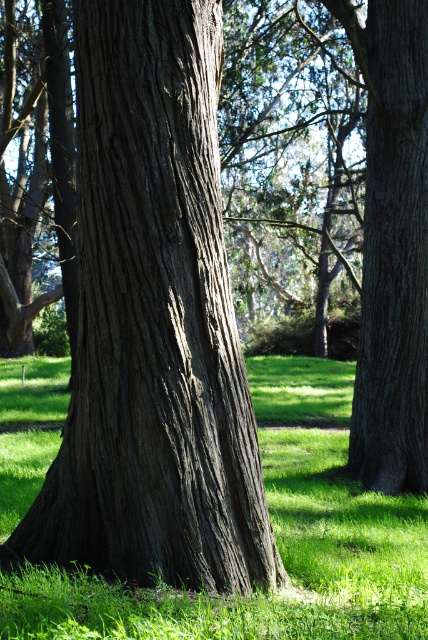
Which is more to the right, dark brown textured bark at center or dark brown textured tree trunk at center?

dark brown textured tree trunk at center is more to the right.

Looking at this image, does dark brown textured bark at center appear under dark brown textured tree trunk at center?

Yes.

This screenshot has height=640, width=428. Describe the element at coordinates (154, 321) in the screenshot. I see `dark brown textured bark at center` at that location.

What are the coordinates of `dark brown textured bark at center` in the screenshot? It's located at (154, 321).

Does dark brown textured bark at center have a greater height compared to green grassy at center?

Correct, dark brown textured bark at center is much taller as green grassy at center.

Can you confirm if dark brown textured bark at center is positioned above green grassy at center?

Yes.

This screenshot has height=640, width=428. In order to click on dark brown textured bark at center in this screenshot , I will do `click(154, 321)`.

Who is shorter, green grassy at center or dark brown textured tree trunk at center?

green grassy at center is shorter.

Is point (270, 401) farther from viewer compared to point (383, 259)?

That is True.

Is point (5, 369) more distant than point (369, 17)?

Yes, it is behind point (369, 17).

This screenshot has height=640, width=428. I want to click on green grassy at center, so click(x=276, y=541).